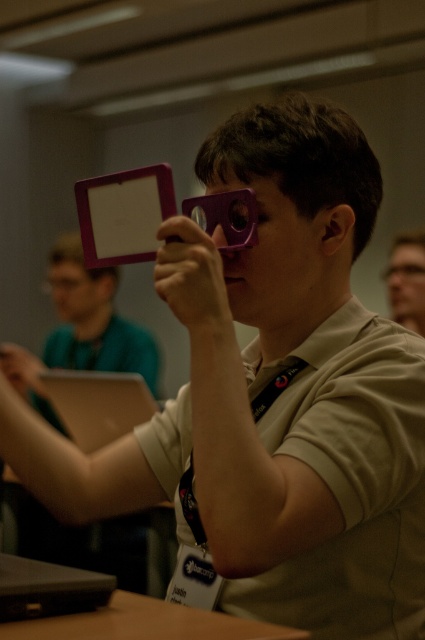
Question: Can you confirm if pink matte tablet at upper center is positioned to the right of transparent plastic glasses at upper center?

Choices:
 (A) yes
 (B) no

Answer: (B)

Question: Is matte black glasses at upper center further to camera compared to transparent plastic glasses at upper center?

Choices:
 (A) no
 (B) yes

Answer: (A)

Question: Which point is closer to the camera taking this photo?

Choices:
 (A) (408, 301)
 (B) (391, 273)
 (C) (119, 220)

Answer: (C)

Question: Which object is the farthest from the matte black glasses at upper center?

Choices:
 (A) transparent plastic glasses at upper center
 (B) pink matte tablet at upper center

Answer: (B)

Question: Among these objects, which one is farthest from the camera?

Choices:
 (A) pink matte tablet at upper center
 (B) transparent plastic glasses at upper center
 (C) matte black glasses at upper center

Answer: (B)

Question: Can you confirm if pink matte tablet at upper center is positioned above matte black glasses at upper center?

Choices:
 (A) yes
 (B) no

Answer: (B)